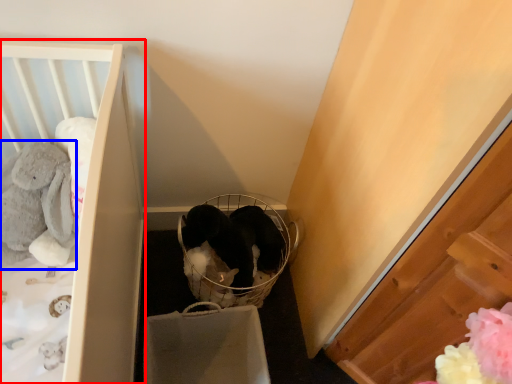
Question: Among these objects, which one is farthest to the camera, furniture (highlighted by a red box) or animal (highlighted by a blue box)?

Choices:
 (A) furniture
 (B) animal

Answer: (B)